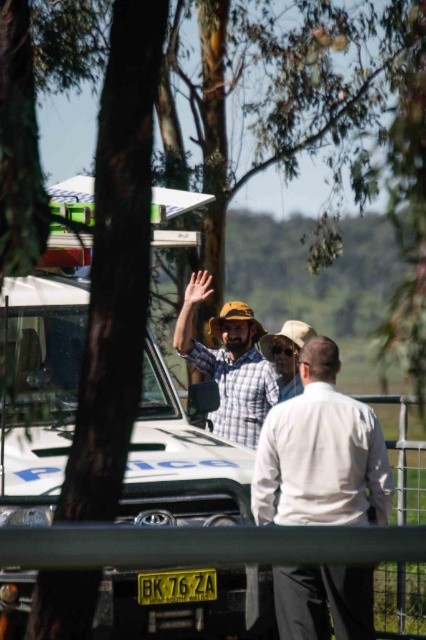
You are a pedestrian standing near the white matte police car at center and the checkered fabric shirt at center. Which object is taller?

The white matte police car at center is much taller than the checkered fabric shirt at center.

You are standing at the origin point of the coordinate system. Where is the metallic silver fence at lower center located?

The metallic silver fence at lower center is located at point (405, 461).